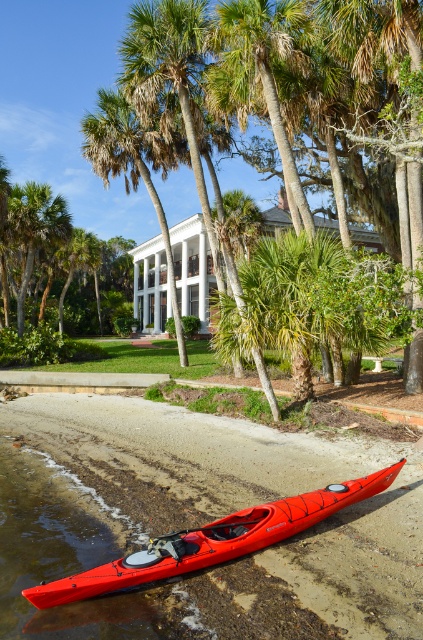
Is green leafy palm tree at center below green leafy palm tree at left?

Incorrect, green leafy palm tree at center is not positioned below green leafy palm tree at left.

What do you see at coordinates (129, 170) in the screenshot? This screenshot has width=423, height=640. I see `green leafy palm tree at center` at bounding box center [129, 170].

Identify the location of green leafy palm tree at center. The width and height of the screenshot is (423, 640). (129, 170).

Image resolution: width=423 pixels, height=640 pixels. Describe the element at coordinates (213, 540) in the screenshot. I see `shiny red kayak at lower left` at that location.

Who is positioned more to the right, shiny red kayak at lower left or green leafy palm tree at left?

shiny red kayak at lower left is more to the right.

Is point (318, 520) farther from viewer compared to point (21, 192)?

No, (318, 520) is closer to viewer.

Where is `shiny red kayak at lower left`? The height and width of the screenshot is (640, 423). shiny red kayak at lower left is located at coordinates (213, 540).

How far apart are shiny red kayak at lower left and green leafy palm tree at center?

The distance of shiny red kayak at lower left from green leafy palm tree at center is 16.95 meters.

Is shiny red kayak at lower left positioned at the back of green leafy palm tree at center?

No, shiny red kayak at lower left is in front of green leafy palm tree at center.

Between point (241, 512) and point (106, 173), which one is positioned in front?

Point (241, 512)

Identify the location of shiny red kayak at lower left. This screenshot has height=640, width=423. (213, 540).